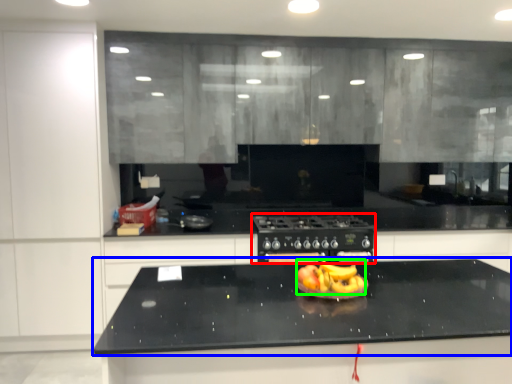
Question: Which object is positioned closest to home appliance (highlighted by a red box)? Select from countertop (highlighted by a blue box) and fruit dish (highlighted by a green box).

Choices:
 (A) countertop
 (B) fruit dish

Answer: (A)